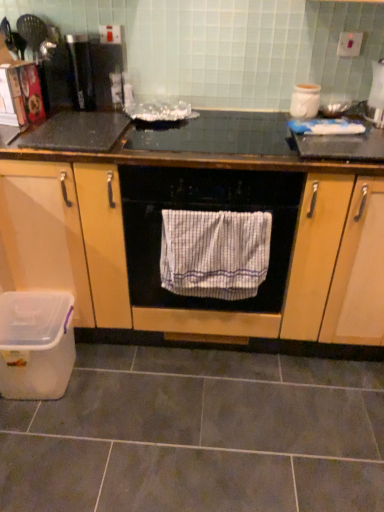
Identify the location of free space above white striped towel at center (from a real-world perspective). (218, 209).